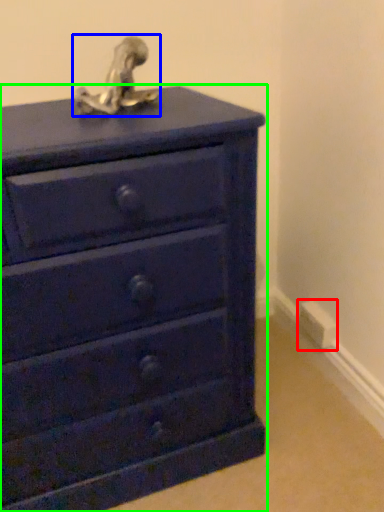
Question: Considering the real-world distances, which object is closest to electric outlet (highlighted by a red box)? sculpture (highlighted by a blue box) or chest of drawers (highlighted by a green box).

Choices:
 (A) sculpture
 (B) chest of drawers

Answer: (B)